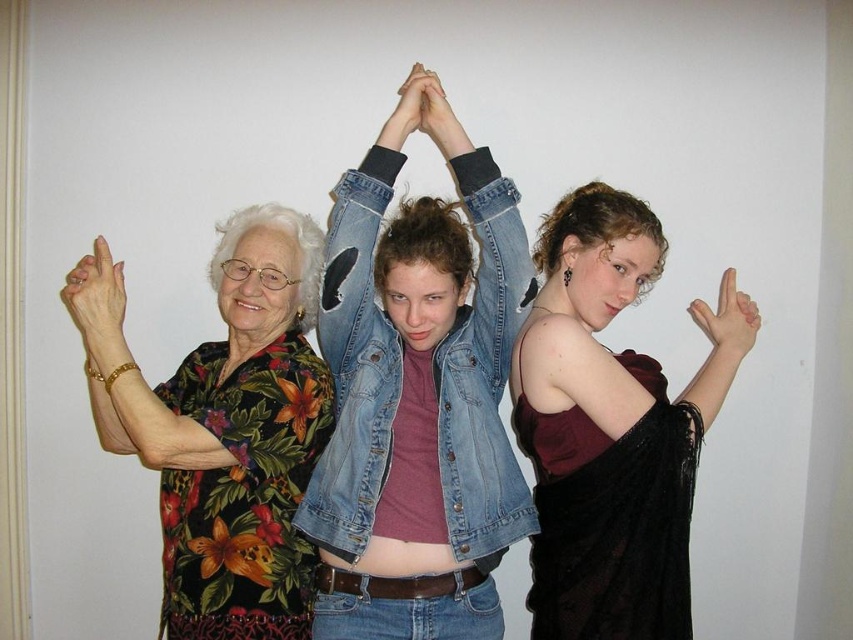
Question: Based on their relative distances, which object is farther from the matte denim jacket at center?

Choices:
 (A) matte gold ring at upper left
 (B) matte skin hands at center
 (C) floral print shirt at left
 (D) black matte hand at upper right

Answer: (D)

Question: Among these points, which one is nearest to the camera?

Choices:
 (A) (235, 304)
 (B) (592, 184)
 (C) (102, 417)

Answer: (C)

Question: Which object is the closest to the faded denim jacket at center?

Choices:
 (A) black matte hand at upper right
 (B) matte skin hand at upper right
 (C) velvet maroon dress at center

Answer: (C)

Question: Does velvet maroon dress at center lie in front of matte denim jacket at center?

Choices:
 (A) no
 (B) yes

Answer: (A)

Question: Does velvet maroon dress at center lie in front of matte gold ring at upper left?

Choices:
 (A) yes
 (B) no

Answer: (A)

Question: Does faded denim jacket at center have a greater width compared to matte skin hand at upper right?

Choices:
 (A) yes
 (B) no

Answer: (A)